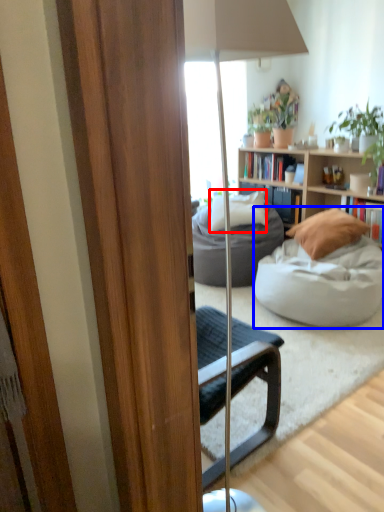
Question: Which of the following is the farthest to the observer, pillow (highlighted by a red box) or studio couch (highlighted by a blue box)?

Choices:
 (A) pillow
 (B) studio couch

Answer: (A)